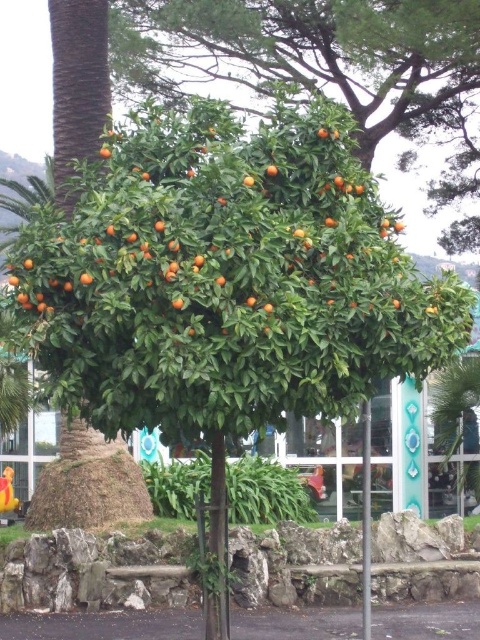
Question: Which point is closer to the camera?

Choices:
 (A) (165, 67)
 (B) (365, 449)

Answer: (B)

Question: Does green leafy tree at center have a larger size compared to green leafy palm tree at center?

Choices:
 (A) no
 (B) yes

Answer: (B)

Question: Can you confirm if green leafy tree at center is positioned above green leafy palm tree at center?

Choices:
 (A) yes
 (B) no

Answer: (A)

Question: Which object is positioned closest to the green leafy palm tree at center?

Choices:
 (A) metallic pole at center
 (B) green leafy tree at center

Answer: (A)

Question: Among these objects, which one is nearest to the camera?

Choices:
 (A) metallic pole at center
 (B) green leafy palm tree at center

Answer: (A)

Question: Is green leafy tree at center thinner than green leafy palm tree at center?

Choices:
 (A) no
 (B) yes

Answer: (A)